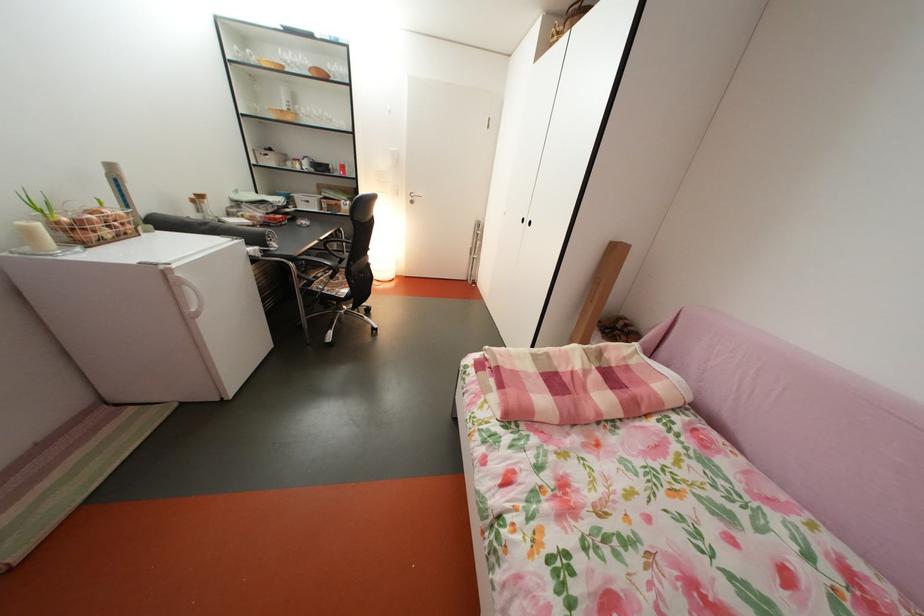
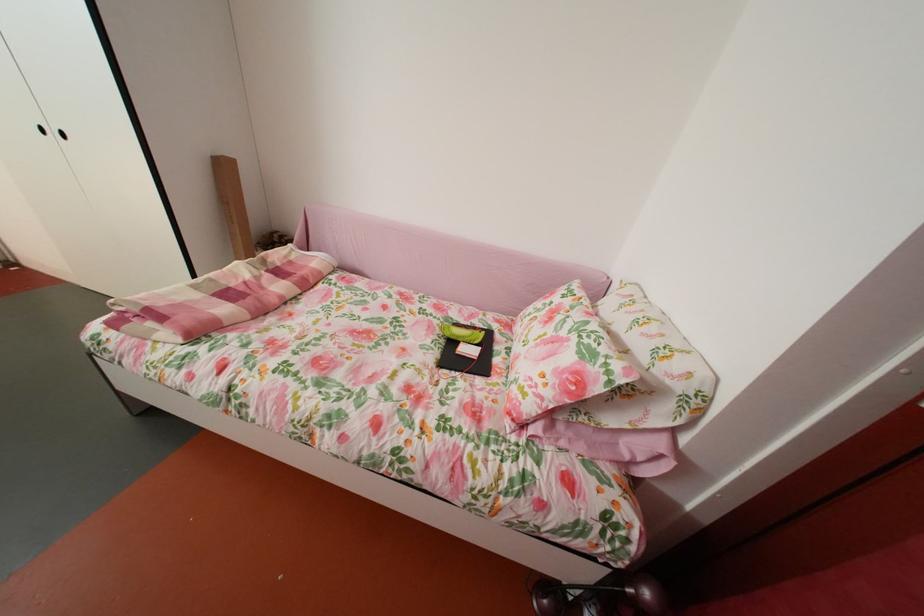
The point at [538,228] is marked in the first image. Where is the corresponding point in the second image?

(65, 139)